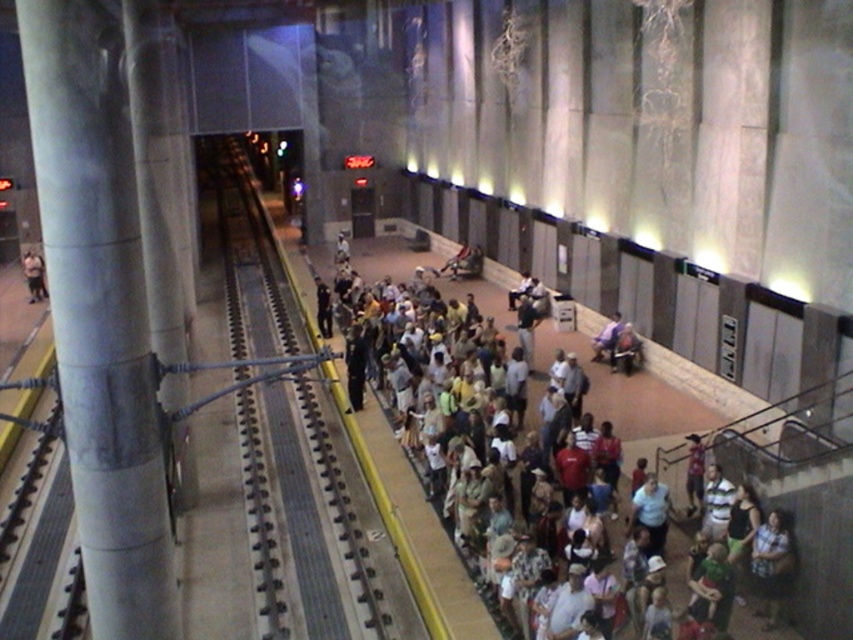
You are standing on the platform and want to locate the smooth metal track at center. Where exactly is it located?

The smooth metal track at center is located at point (312, 518).

You are standing on the platform of a busy train station and notice a white cotton shirt at center. If you want to locate it precisely, what are its coordinates?

The white cotton shirt at center is located at coordinates point (647,408).